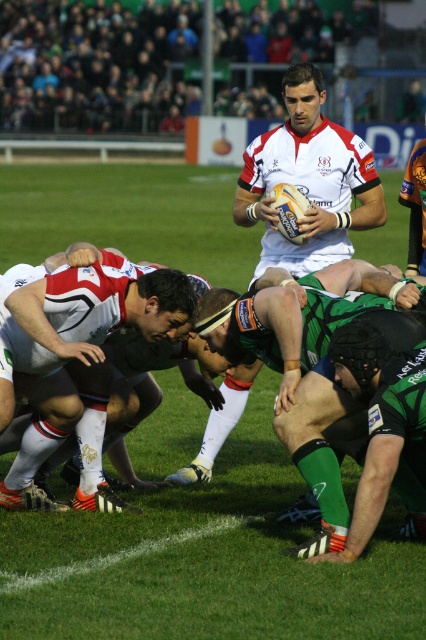
Question: Is green fabric jersey at center closer to camera compared to green jersey at lower right?

Choices:
 (A) no
 (B) yes

Answer: (A)

Question: Which point is closer to the camera?

Choices:
 (A) (388, 397)
 (B) (250, 198)
 (C) (291, 454)
 (D) (28, 320)

Answer: (A)

Question: Does green fabric jersey at center have a lesser width compared to green jersey at lower right?

Choices:
 (A) no
 (B) yes

Answer: (A)

Question: Which object is farther from the camera taking this photo?

Choices:
 (A) green jersey at lower right
 (B) white matte rugby ball at center

Answer: (B)

Question: Which point is farther from the camera taking this photo?

Choices:
 (A) (71, 429)
 (B) (370, 385)
 (C) (258, 317)

Answer: (A)

Question: Can you confirm if white matte rugby ball at center is positioned below green jersey at lower right?

Choices:
 (A) no
 (B) yes

Answer: (A)